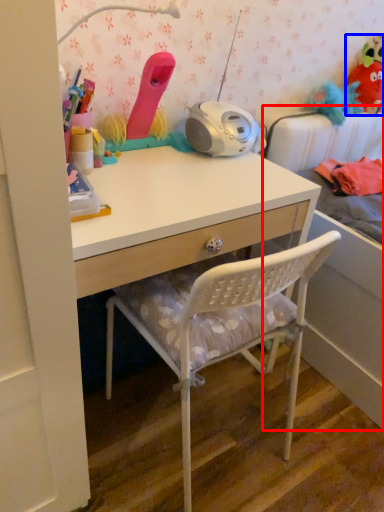
Question: Which object appears closest to the camera in this image, bed (highlighted by a red box) or toy (highlighted by a blue box)?

Choices:
 (A) bed
 (B) toy

Answer: (A)